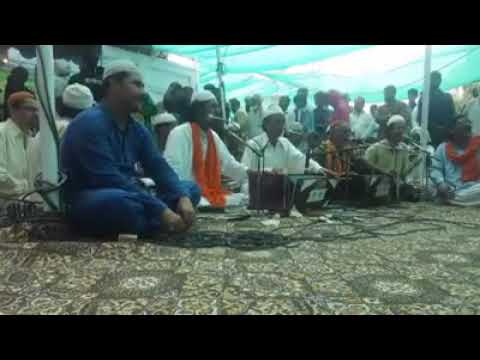
Find the location of a particular element. This screenshot has width=480, height=360. table is located at coordinates (294, 188), (380, 187).